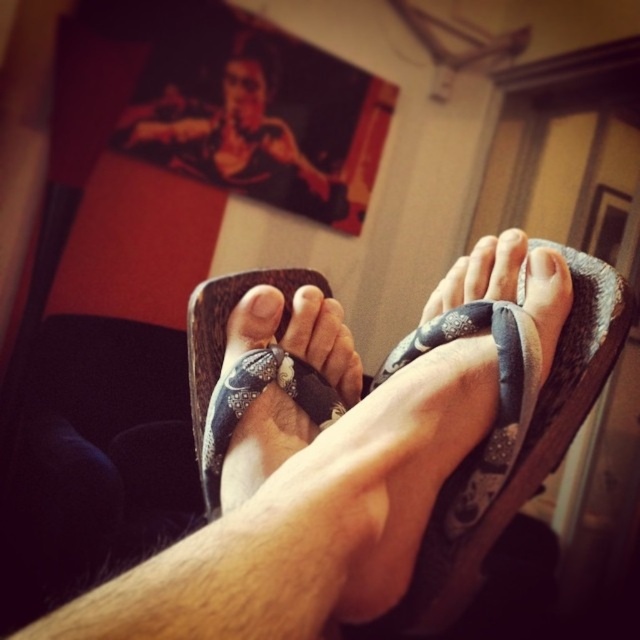
Is point (248, 477) more distant than point (300, 284)?

No.

I want to click on leather sandals at center, so click(365, 460).

Can you confirm if leather sandal at center is positioned below matte gray sandal at center?

Indeed, leather sandal at center is positioned under matte gray sandal at center.

Can you confirm if leather sandal at center is taller than matte gray sandal at center?

Indeed, leather sandal at center has a greater height compared to matte gray sandal at center.

Does point (193, 337) come closer to viewer compared to point (557, 260)?

That is False.

You are a GUI agent. You are given a task and a screenshot of the screen. Output one action in this format:
    pyautogui.click(x=<x>, y=<y>)
    Task: Click on the leather sandal at center
    This screenshot has width=640, height=640.
    Given the screenshot: What is the action you would take?
    (x=227, y=330)

Is point (90, 620) closer to camera compared to point (266, 289)?

Yes.

In the scene shown: Does leather sandals at center appear under white matte toe at center?

Correct, leather sandals at center is located below white matte toe at center.

Which is behind, point (186, 570) or point (273, 291)?

Positioned behind is point (273, 291).

Find the location of a particular element. The height and width of the screenshot is (640, 640). leather sandals at center is located at coordinates (365, 460).